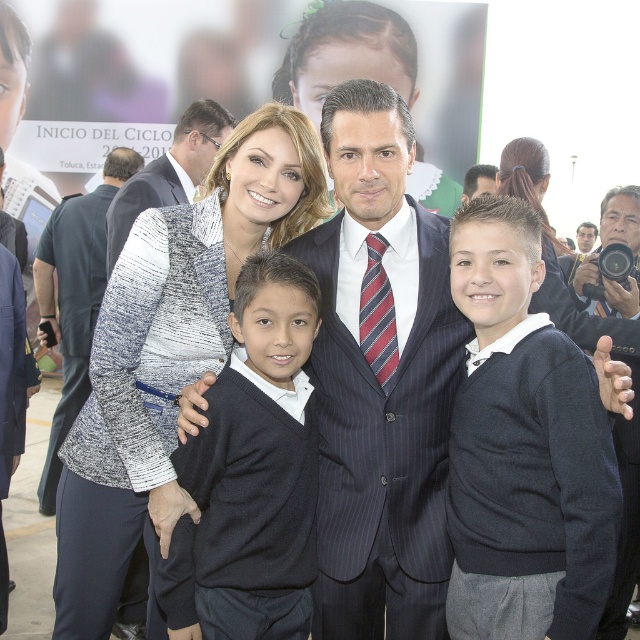
Question: Does white textured dress at center have a smaller size compared to dark gray suit at center?

Choices:
 (A) no
 (B) yes

Answer: (A)

Question: Among these points, which one is nearest to the camera?

Choices:
 (A) (134, 182)
 (B) (298, 426)
 (C) (77, 220)
 (D) (618, 211)

Answer: (B)

Question: Can you confirm if dark gray sweater at center is positioned above dark gray suit at center?

Choices:
 (A) yes
 (B) no

Answer: (B)

Question: Does white textured sweater at center appear on the left side of dark blue suit at center?

Choices:
 (A) no
 (B) yes

Answer: (B)

Question: Which point is closer to the camera?

Choices:
 (A) (90, 387)
 (B) (376, 388)
 (C) (500, 454)

Answer: (C)

Question: Among these points, which one is farthest from the camera?

Choices:
 (A) (620, 308)
 (B) (48, 253)
 (C) (625, 577)
 (D) (333, 394)

Answer: (B)